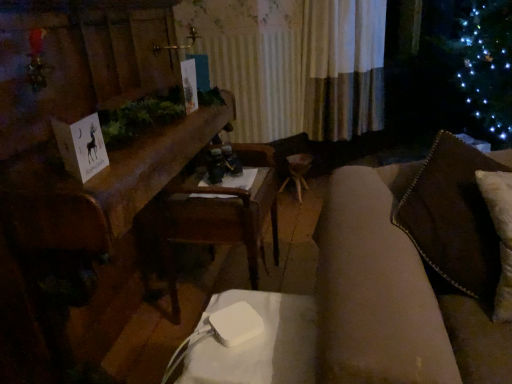
The width and height of the screenshot is (512, 384). In order to click on white plastic table at lower center in this screenshot , I will do `click(259, 343)`.

From a real-world perspective, which object rests below the other?

In real-world perspective, wooden armchair at center is lower.

Is wooden table at center bigger than wooden armchair at center?

Yes, wooden table at center is bigger than wooden armchair at center.

Is wooden table at center located outside wooden armchair at center?

That's correct, wooden table at center is outside of wooden armchair at center.

Identify the location of furniture that is in front of the wooden armchair at center. (74, 178).

Looking at this image, is wooden table at center turned away from white plastic table at lower center?

wooden table at center does not have its back to white plastic table at lower center.

Is point (88, 308) closer or farther from the camera than point (261, 347)?

Point (88, 308) is positioned farther from the camera compared to point (261, 347).

Considering the sizes of objects wooden table at center and white plastic table at lower center in the image provided, who is smaller, wooden table at center or white plastic table at lower center?

With smaller size is white plastic table at lower center.

Can you tell me how much wooden table at center and white plastic table at lower center differ in facing direction?

The angular difference between wooden table at center and white plastic table at lower center is 91.8 degrees.

Is white plastic table at lower center touching wooden table at center?

There is a gap between white plastic table at lower center and wooden table at center.

Is white plastic table at lower center shorter than wooden table at center?

Indeed, white plastic table at lower center has a lesser height compared to wooden table at center.

Is white plastic table at lower center bigger or smaller than wooden table at center?

Considering their sizes, white plastic table at lower center takes up less space than wooden table at center.

What's the angular difference between white plastic table at lower center and wooden table at center's facing directions?

The angle between the facing direction of white plastic table at lower center and the facing direction of wooden table at center is 91.8 degrees.

Is white plastic table at lower center completely or partially outside of white paper card at left?

Absolutely, white plastic table at lower center is external to white paper card at left.

Looking at their sizes, would you say white plastic table at lower center is wider or thinner than white paper card at left?

Considering their sizes, white plastic table at lower center looks broader than white paper card at left.

Is white plastic table at lower center looking in the opposite direction of white paper card at left?

No.

Between point (277, 344) and point (70, 130), which one is positioned in front?

Positioned in front is point (277, 344).

Is point (82, 133) less distant than point (209, 360)?

No, it is not.

Is white paper card at left beside white plastic table at lower center?

No.

Does white paper card at left have a larger size compared to white plastic table at lower center?

Incorrect, white paper card at left is not larger than white plastic table at lower center.

Considering their positions, is white paper card at left located in front of or behind white plastic table at lower center?

In the image, white paper card at left appears behind white plastic table at lower center.

Does wooden armchair at center have a lesser width compared to white plastic table at lower center?

No.

Can white plastic table at lower center be found inside wooden armchair at center?

That's incorrect, white plastic table at lower center is not inside wooden armchair at center.

Is wooden armchair at center behind white plastic table at lower center?

A: That is True.

In terms of height, does wooden armchair at center look taller or shorter compared to white plastic table at lower center?

In the image, wooden armchair at center appears to be taller than white plastic table at lower center.

Can we say wooden table at center lies outside white paper card at left?

wooden table at center lies outside white paper card at left's area.

Is wooden table at center thinner than white paper card at left?

No, wooden table at center is not thinner than white paper card at left.

Does point (22, 208) come closer to viewer compared to point (73, 152)?

That is True.

Find the location of a particular element. This screenshot has width=512, height=384. armchair below the wooden table at center (from a real-world perspective) is located at coordinates (209, 219).

Where is `table located below the wooden table at center (from the image's perspective)`? The image size is (512, 384). table located below the wooden table at center (from the image's perspective) is located at coordinates (259, 343).

Considering their positions, is wooden armchair at center positioned further to white plastic table at lower center than wooden table at center?

wooden table at center lies further to white plastic table at lower center than the other object.

From the image, which object appears to be farther from wooden table at center, wooden armchair at center or white paper card at left?

white paper card at left.

When comparing their distances from white paper card at left, does wooden table at center or wooden armchair at center seem further?

Based on the image, wooden armchair at center appears to be further to white paper card at left.

Estimate the real-world distances between objects in this image. Which object is closer to wooden armchair at center, white paper card at left or wooden table at center?

wooden table at center is positioned closer to the anchor wooden armchair at center.

Estimate the real-world distances between objects in this image. Which object is closer to white plastic table at lower center, wooden table at center or wooden armchair at center?

Based on the image, wooden armchair at center appears to be nearer to white plastic table at lower center.

When comparing their distances from white plastic table at lower center, does white paper card at left or wooden armchair at center seem further?

wooden armchair at center is positioned further to the anchor white plastic table at lower center.

Considering their positions, is white plastic table at lower center positioned closer to wooden armchair at center than white paper card at left?

white paper card at left is closer to wooden armchair at center.

Based on their spatial positions, is white paper card at left or white plastic table at lower center further from wooden armchair at center?

Among the two, white plastic table at lower center is located further to wooden armchair at center.

The image size is (512, 384). Find the location of `furniture between white paper card at left and white plastic table at lower center in the vertical direction`. furniture between white paper card at left and white plastic table at lower center in the vertical direction is located at coordinates (74, 178).

Where is `christmas card between wooden table at center and wooden armchair at center in the front-back direction`? christmas card between wooden table at center and wooden armchair at center in the front-back direction is located at coordinates (81, 146).

Identify the location of christmas card positioned between white plastic table at lower center and wooden armchair at center from near to far. (81, 146).

Image resolution: width=512 pixels, height=384 pixels. I want to click on table positioned between wooden table at center and wooden armchair at center from near to far, so click(259, 343).